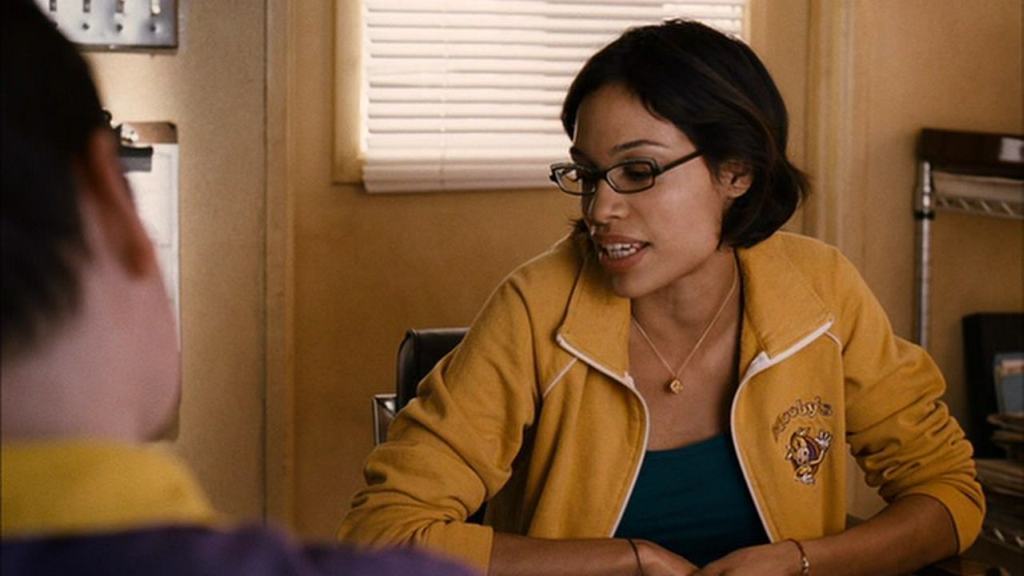
This screenshot has width=1024, height=576. What are the coordinates of `rack` in the screenshot? It's located at (942, 180).